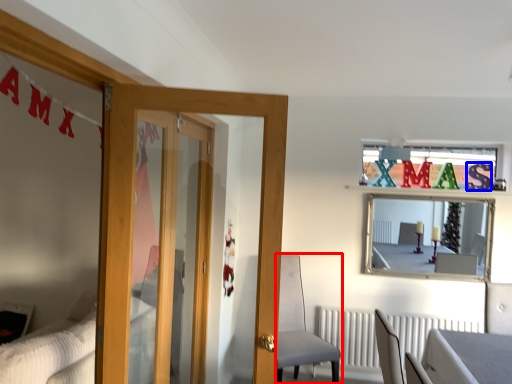
Question: Which object is closer to the camera taking this photo, chair (highlighted by a red box) or letter (highlighted by a blue box)?

Choices:
 (A) chair
 (B) letter

Answer: (A)